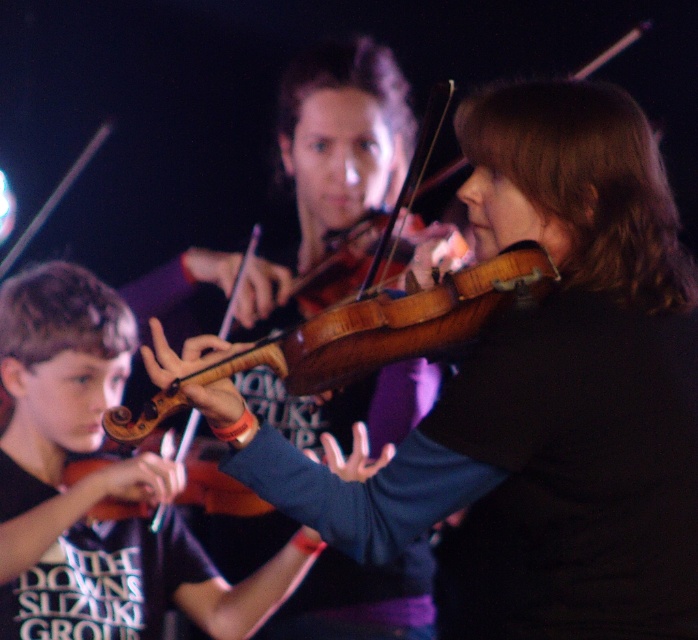
Question: Is wooden violin at center wider than matte brown violin at lower left?

Choices:
 (A) no
 (B) yes

Answer: (B)

Question: Is wooden violin at center positioned behind matte brown violin at lower left?

Choices:
 (A) no
 (B) yes

Answer: (A)

Question: Which of the following is the closest to the observer?

Choices:
 (A) (637, 440)
 (B) (198, 604)

Answer: (A)

Question: Which of the following is the farthest from the observer?

Choices:
 (A) (655, 248)
 (B) (8, 476)

Answer: (B)

Question: Is wooden violin at center bigger than matte brown violin at lower left?

Choices:
 (A) yes
 (B) no

Answer: (A)